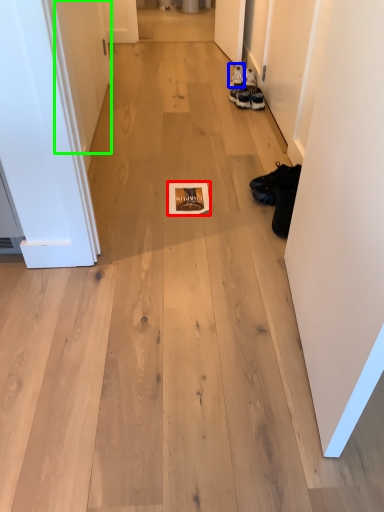
Question: Considering the real-world distances, which object is closest to magazine (highlighted by a red box)? footwear (highlighted by a blue box) or door (highlighted by a green box).

Choices:
 (A) footwear
 (B) door

Answer: (B)